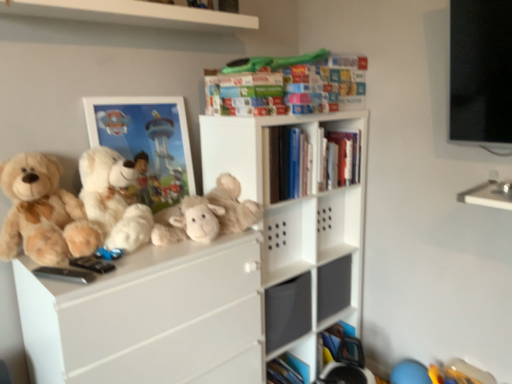
Identify the location of blank space above matte plastic picture frame at upper left (from a real-world perspective). (142, 91).